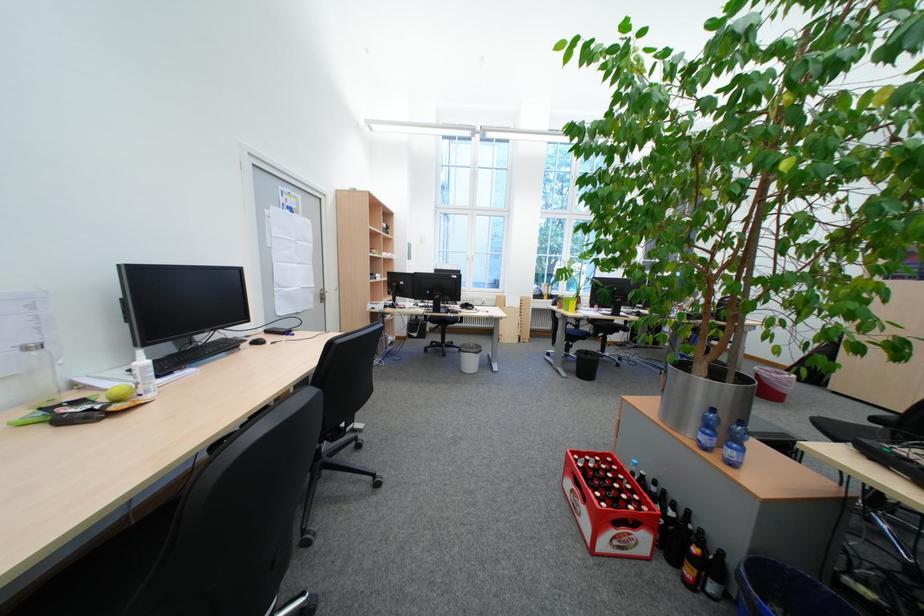
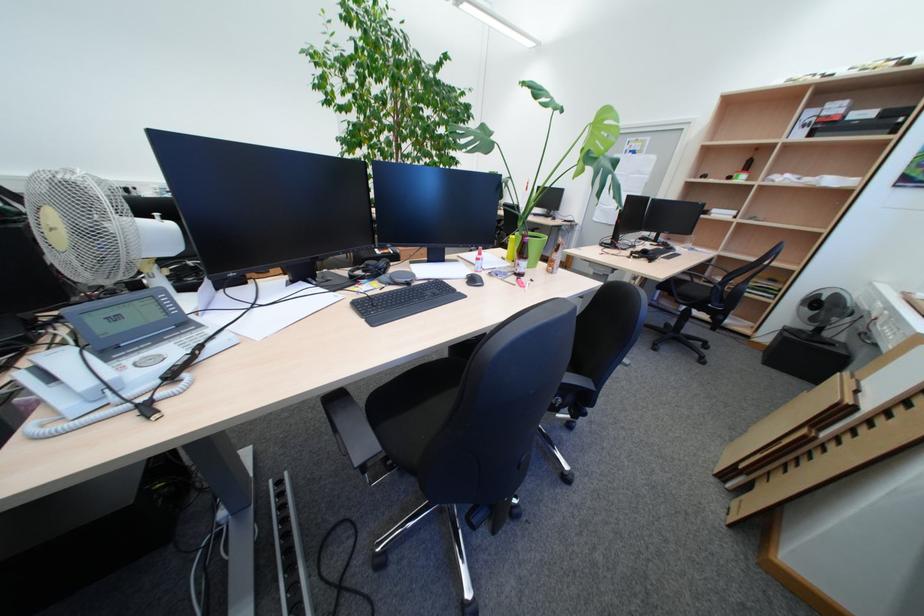
Question: I am providing you with two images of the same scene from different viewpoints. Please identify which objects are invisible in image2.

Choices:
 (A) blue plastic bucket
 (B) amazon cardboard box
 (C) black computer mouse
 (D) red and white glue stick

Answer: (A)